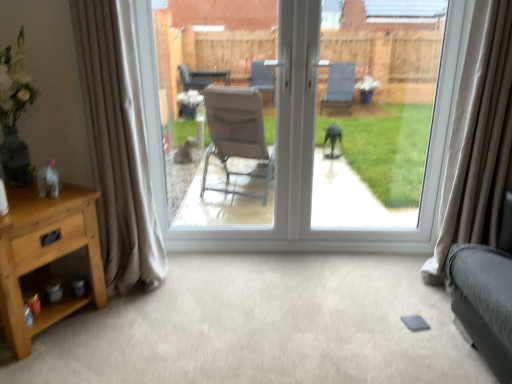
Question: Does transparent glass door at center touch beige velvet curtain at right, which appears as the first curtain when viewed from the right?

Choices:
 (A) no
 (B) yes

Answer: (A)

Question: From a real-world perspective, does transparent glass door at center sit lower than beige velvet curtain at right, which appears as the first curtain when viewed from the right?

Choices:
 (A) yes
 (B) no

Answer: (B)

Question: Considering the relative sizes of transparent glass door at center and beige velvet curtain at right, which appears as the first curtain when viewed from the right, in the image provided, is transparent glass door at center bigger than beige velvet curtain at right, which appears as the first curtain when viewed from the right,?

Choices:
 (A) no
 (B) yes

Answer: (B)

Question: Does transparent glass door at center have a greater height compared to beige velvet curtain at right, the second curtain in the left-to-right sequence?

Choices:
 (A) no
 (B) yes

Answer: (B)

Question: Is transparent glass door at center smaller than beige velvet curtain at right, which appears as the first curtain when viewed from the right?

Choices:
 (A) no
 (B) yes

Answer: (A)

Question: From the image's perspective, relative to light brown wood nightstand at lower left, is transparent glass window at center above or below?

Choices:
 (A) above
 (B) below

Answer: (A)

Question: Based on their positions, is transparent glass window at center located to the left or right of light brown wood nightstand at lower left?

Choices:
 (A) left
 (B) right

Answer: (B)

Question: In terms of width, does transparent glass window at center look wider or thinner when compared to light brown wood nightstand at lower left?

Choices:
 (A) wide
 (B) thin

Answer: (B)

Question: From a real-world perspective, is transparent glass window at center above or below light brown wood nightstand at lower left?

Choices:
 (A) above
 (B) below

Answer: (A)

Question: Which is correct: light brown wood nightstand at lower left is inside beige velvet curtain at right, which appears as the first curtain when viewed from the right, or outside of it?

Choices:
 (A) outside
 (B) inside

Answer: (A)

Question: Does point (34, 223) appear closer or farther from the camera than point (504, 92)?

Choices:
 (A) closer
 (B) farther

Answer: (A)

Question: Considering their positions, is light brown wood nightstand at lower left located in front of or behind beige velvet curtain at right, the second curtain in the left-to-right sequence?

Choices:
 (A) behind
 (B) front

Answer: (B)

Question: From the image's perspective, is light brown wood nightstand at lower left located above or below beige velvet curtain at right, which appears as the first curtain when viewed from the right?

Choices:
 (A) below
 (B) above

Answer: (A)

Question: Is beige velvet curtain at right, the second curtain in the left-to-right sequence, taller or shorter than transparent glass door at center?

Choices:
 (A) short
 (B) tall

Answer: (A)

Question: Looking at their shapes, would you say beige velvet curtain at right, which appears as the first curtain when viewed from the right, is wider or thinner than transparent glass door at center?

Choices:
 (A) thin
 (B) wide

Answer: (B)